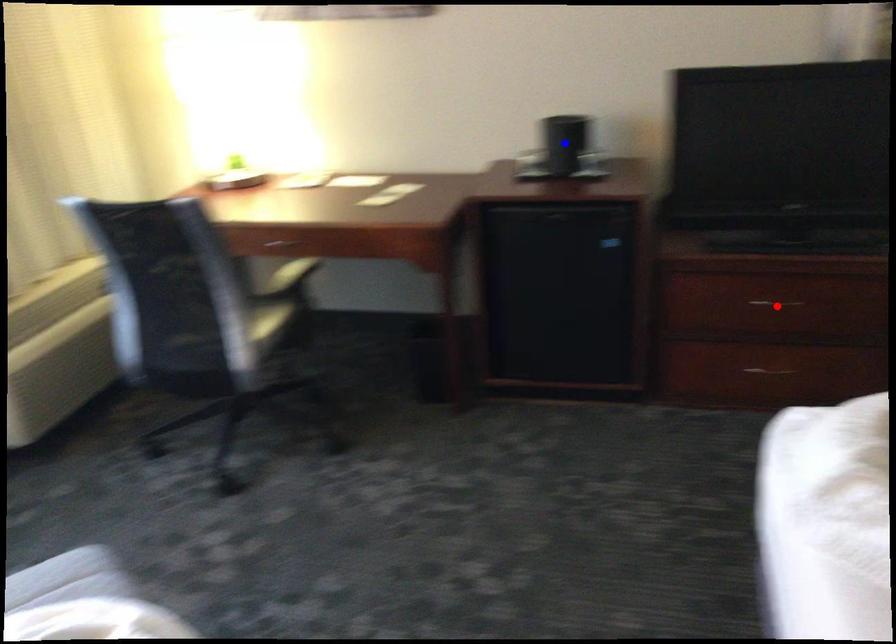
Question: Two points are marked on the image. Which point is closer to the camera?

Choices:
 (A) Blue point is closer.
 (B) Red point is closer.

Answer: (B)